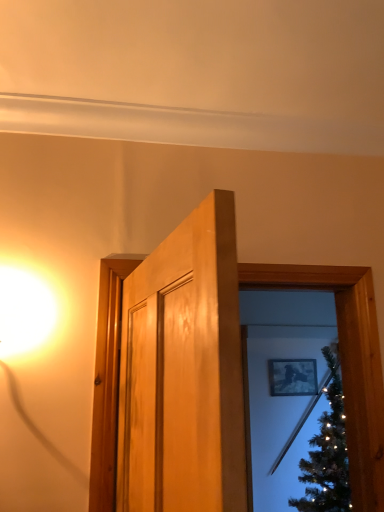
Question: Is wooden door frame at center, which is counted as the 1th window frame, starting from the back, facing towards matte black picture frame at upper center?

Choices:
 (A) yes
 (B) no

Answer: (B)

Question: Can you confirm if wooden door frame at center, arranged as the 2th window frame when viewed from the front, is smaller than matte black picture frame at upper center?

Choices:
 (A) yes
 (B) no

Answer: (B)

Question: Is wooden door frame at center, which is counted as the 1th window frame, starting from the back, positioned before matte black picture frame at upper center?

Choices:
 (A) yes
 (B) no

Answer: (A)

Question: Is matte black picture frame at upper center inside wooden door frame at center, which is counted as the 1th window frame, starting from the back?

Choices:
 (A) yes
 (B) no

Answer: (B)

Question: Is wooden door frame at center, arranged as the 2th window frame when viewed from the front, bigger than matte black picture frame at upper center?

Choices:
 (A) yes
 (B) no

Answer: (A)

Question: In terms of width, does wooden door at center, the 1th window frame in the front-to-back sequence, look wider or thinner when compared to matte black picture frame at upper center?

Choices:
 (A) wide
 (B) thin

Answer: (A)

Question: From a real-world perspective, relative to matte black picture frame at upper center, is wooden door at center, marked as the second window frame in a back-to-front arrangement, vertically above or below?

Choices:
 (A) below
 (B) above

Answer: (B)

Question: Looking at the image, does wooden door at center, marked as the second window frame in a back-to-front arrangement, seem bigger or smaller compared to matte black picture frame at upper center?

Choices:
 (A) big
 (B) small

Answer: (A)

Question: Considering the positions of point (357, 442) and point (291, 359), is point (357, 442) closer or farther from the camera than point (291, 359)?

Choices:
 (A) closer
 (B) farther

Answer: (A)

Question: From the image's perspective, relative to wooden door at center, the 1th window frame in the front-to-back sequence, is matte black picture frame at upper center above or below?

Choices:
 (A) above
 (B) below

Answer: (B)

Question: Is matte black picture frame at upper center inside or outside of wooden door at center, marked as the second window frame in a back-to-front arrangement?

Choices:
 (A) inside
 (B) outside

Answer: (B)

Question: From a real-world perspective, is matte black picture frame at upper center positioned above or below wooden door at center, the 1th window frame in the front-to-back sequence?

Choices:
 (A) below
 (B) above

Answer: (A)

Question: Is matte black picture frame at upper center taller or shorter than wooden door at center, marked as the second window frame in a back-to-front arrangement?

Choices:
 (A) tall
 (B) short

Answer: (B)

Question: Is wooden door frame at center, which is counted as the 1th window frame, starting from the back, inside the boundaries of wooden door at center, the 1th window frame in the front-to-back sequence, or outside?

Choices:
 (A) outside
 (B) inside

Answer: (A)

Question: Considering the positions of point (360, 480) and point (92, 459), is point (360, 480) closer or farther from the camera than point (92, 459)?

Choices:
 (A) closer
 (B) farther

Answer: (B)